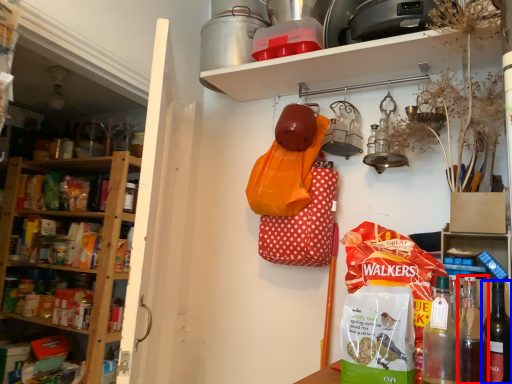
Question: Which object is further to the camera taking this photo, bottle (highlighted by a red box) or bottle (highlighted by a blue box)?

Choices:
 (A) bottle
 (B) bottle

Answer: (B)